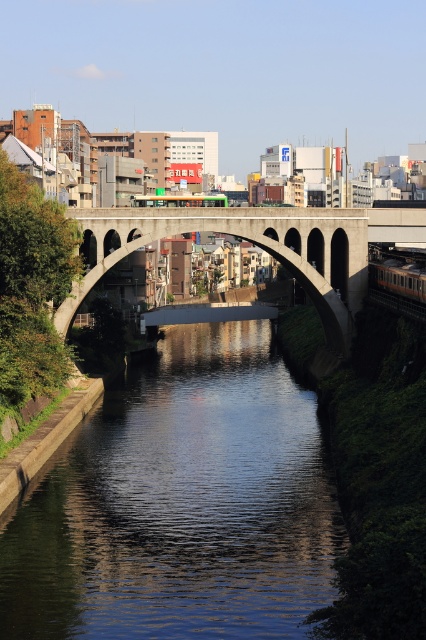
You are a pedestrian standing on the bridge that spans the canal. You see a metallic silver train at center and a red metallic train at center. Which train is closer to the water?

The metallic silver train at center is below the red metallic train at center, so it is closer to the water.